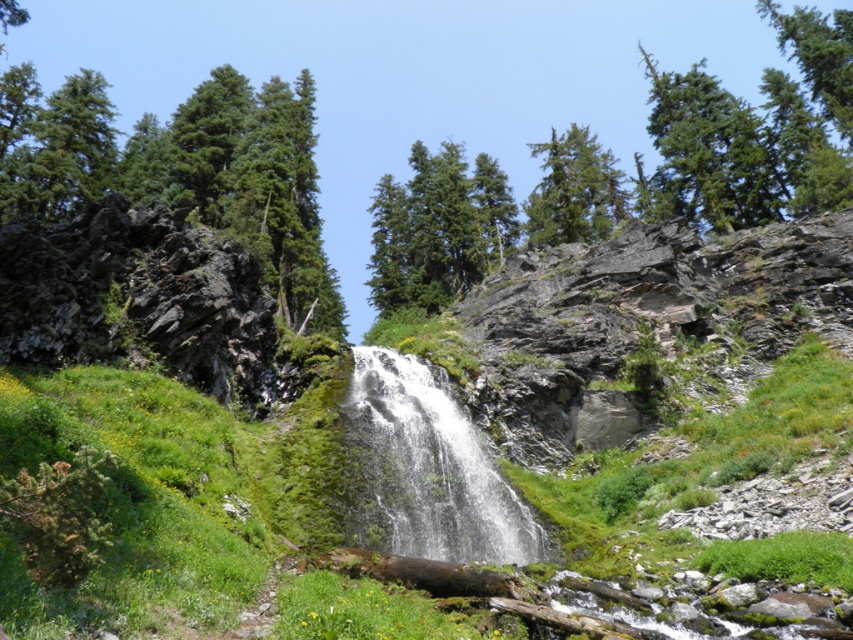
Question: Which object appears farthest from the camera in this image?

Choices:
 (A) green mossy hillside at center
 (B) white frothy water at center
 (C) green evergreen tree at upper center
 (D) green matte tree at upper center

Answer: (D)

Question: Among these objects, which one is nearest to the camera?

Choices:
 (A) green mossy hillside at center
 (B) green evergreen tree at upper center
 (C) green matte tree at upper center

Answer: (A)

Question: Does green mossy hillside at center appear over white frothy water at center?

Choices:
 (A) no
 (B) yes

Answer: (B)

Question: Which is farther from the brown rough log at center?

Choices:
 (A) green evergreen tree at upper center
 (B) white frothy water at center

Answer: (A)

Question: Can you confirm if green mossy hillside at center is bigger than green evergreen tree at upper center?

Choices:
 (A) yes
 (B) no

Answer: (A)

Question: Does green mossy hillside at center have a smaller size compared to white frothy water at center?

Choices:
 (A) no
 (B) yes

Answer: (A)